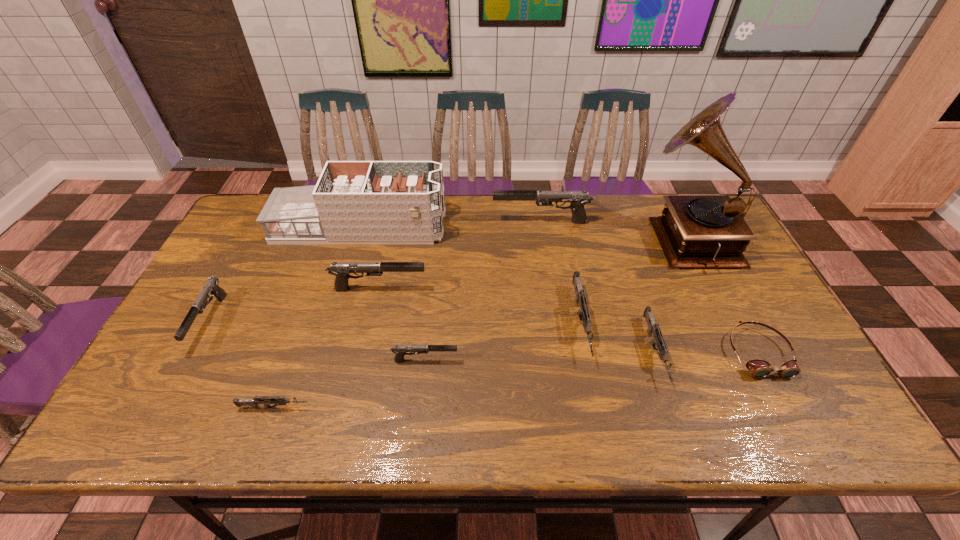
Identify the location of the third object from right to left. (653, 327).

Find the location of a particular element. This screenshot has height=540, width=960. the rightmost gun is located at coordinates (653, 327).

Locate an element on the screen. the smallest gray gun is located at coordinates (400, 350).

You are a GUI agent. You are given a task and a screenshot of the screen. Output one action in this format:
    pyautogui.click(x=<x>, y=<y>)
    Task: Click on the nearest gun
    The height and width of the screenshot is (540, 960).
    Given the screenshot: What is the action you would take?
    (x=282, y=400)

At what (x,y) coordinates should I click in order to perform the action: click on the smallest grey gun. Please return your answer as a coordinate pair (x, y). This screenshot has height=540, width=960. Looking at the image, I should click on (282, 400).

Where is `goggles`? The width and height of the screenshot is (960, 540). goggles is located at coordinates (758, 368).

Locate an element on the screen. This screenshot has width=960, height=540. vacant area situated on the horn of the record player is located at coordinates (529, 237).

Image resolution: width=960 pixels, height=540 pixels. Find the location of `vacant position located 0.100m on the horn of the record player`. vacant position located 0.100m on the horn of the record player is located at coordinates (611, 237).

Image resolution: width=960 pixels, height=540 pixels. I want to click on vacant area situated on the horn of the record player, so click(x=627, y=237).

Locate an element on the screen. The image size is (960, 540). free region located at the entrance of the dollhouse is located at coordinates (509, 228).